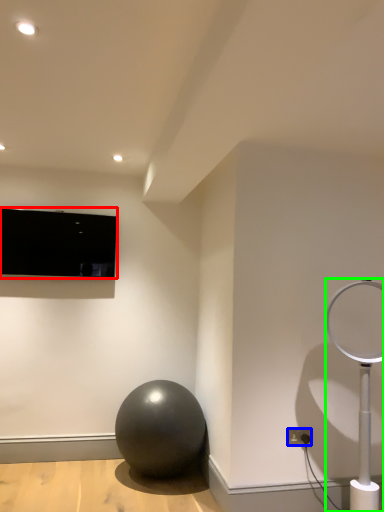
Question: Which is farther away from television (highlighted by a red box)? electric outlet (highlighted by a blue box) or lamp (highlighted by a green box)?

Choices:
 (A) electric outlet
 (B) lamp

Answer: (A)